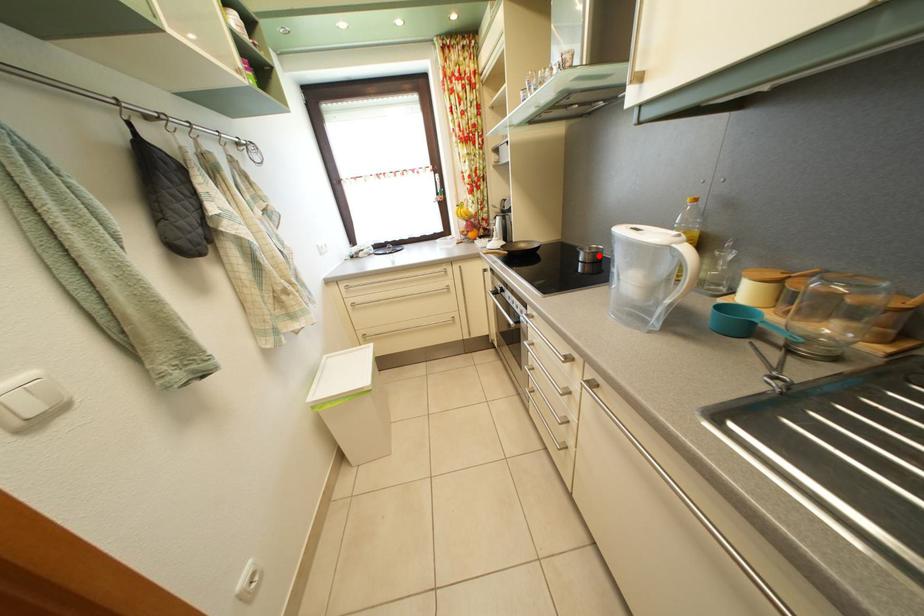
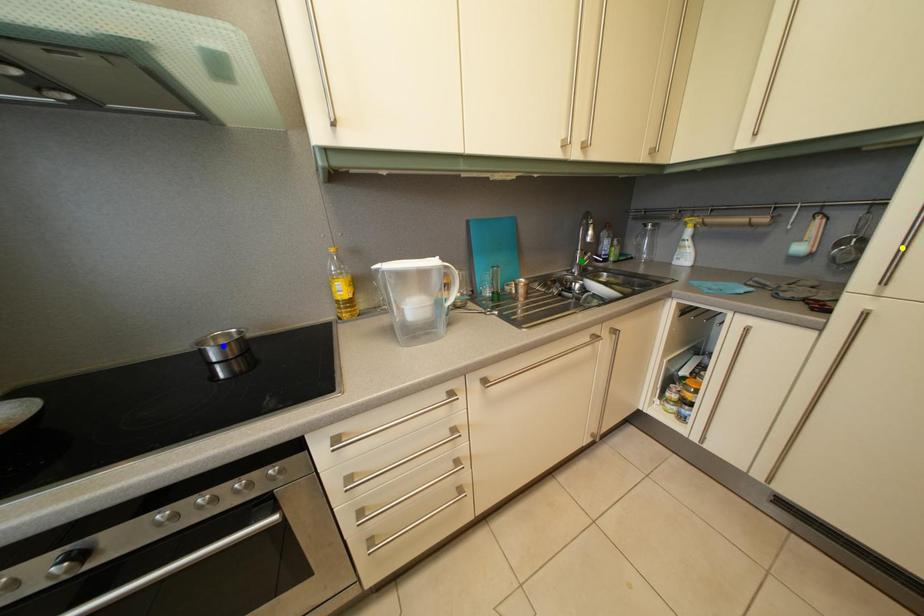
Question: I am providing you with two images of the same scene from different viewpoints. A red point is marked on the first image. You are given multiple points on the second image. Can you choose the point in image 2 that corresponds to the point in image 1?

Choices:
 (A) yellow point
 (B) green point
 (C) blue point

Answer: (C)